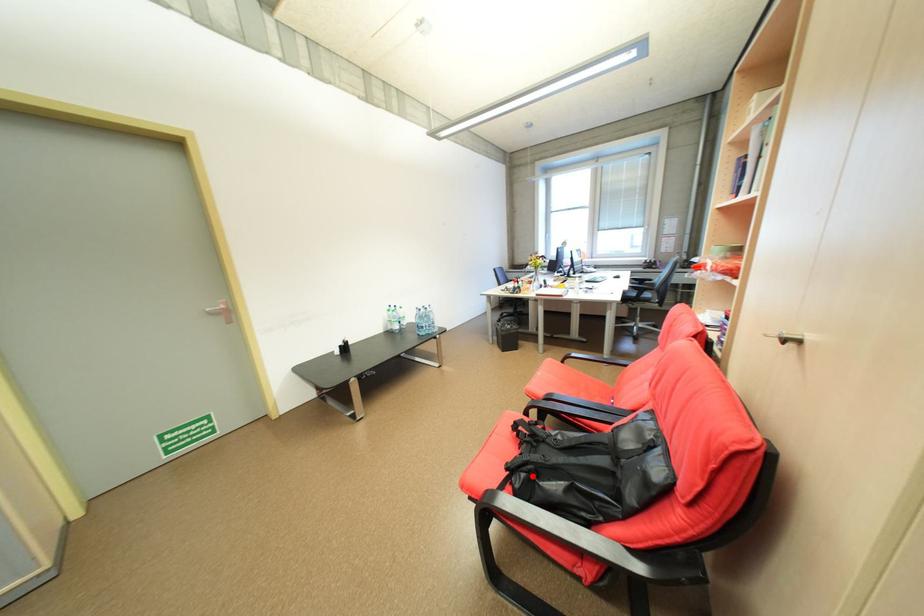
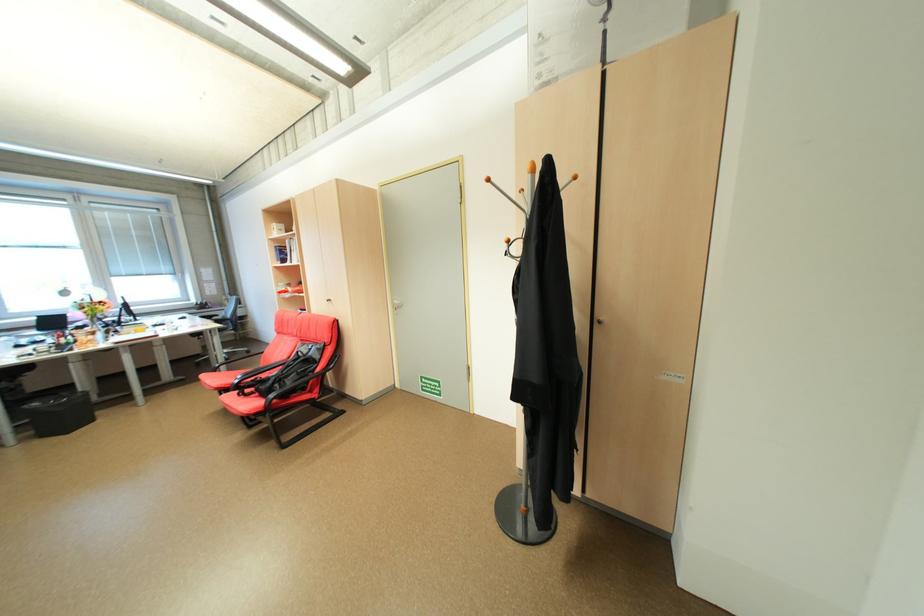
In the second image, find the point that corresponds to the highlighted location in the first image.

(286, 386)